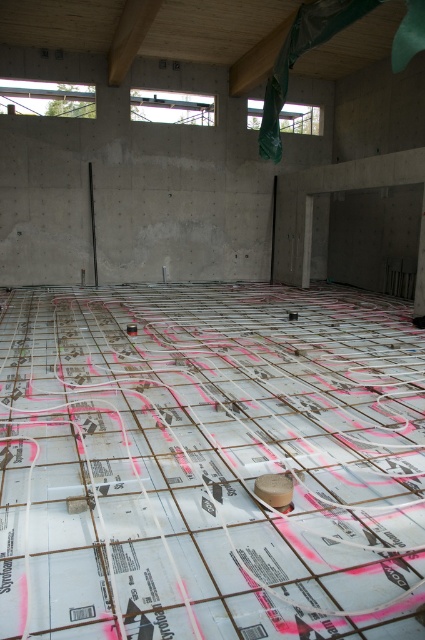
Which is more to the right, white grid concrete at center or white matte tape at center?

white matte tape at center is more to the right.

Can you confirm if white grid concrete at center is smaller than white matte tape at center?

Incorrect, white grid concrete at center is not smaller in size than white matte tape at center.

You are a GUI agent. You are given a task and a screenshot of the screen. Output one action in this format:
    pyautogui.click(x=<x>, y=<y>)
    Task: Click on the white grid concrete at center
    This screenshot has width=425, height=640.
    Given the screenshot: What is the action you would take?
    pyautogui.click(x=209, y=464)